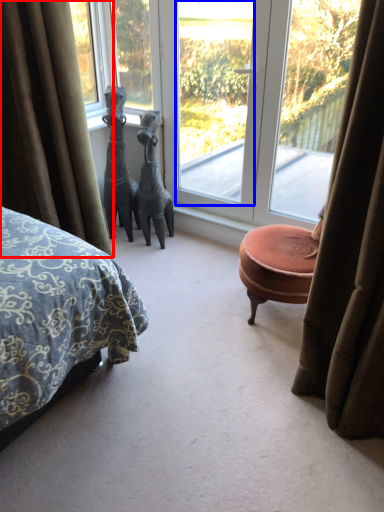
Question: Which object is closer to the camera taking this photo, curtain (highlighted by a red box) or window screen (highlighted by a blue box)?

Choices:
 (A) curtain
 (B) window screen

Answer: (A)